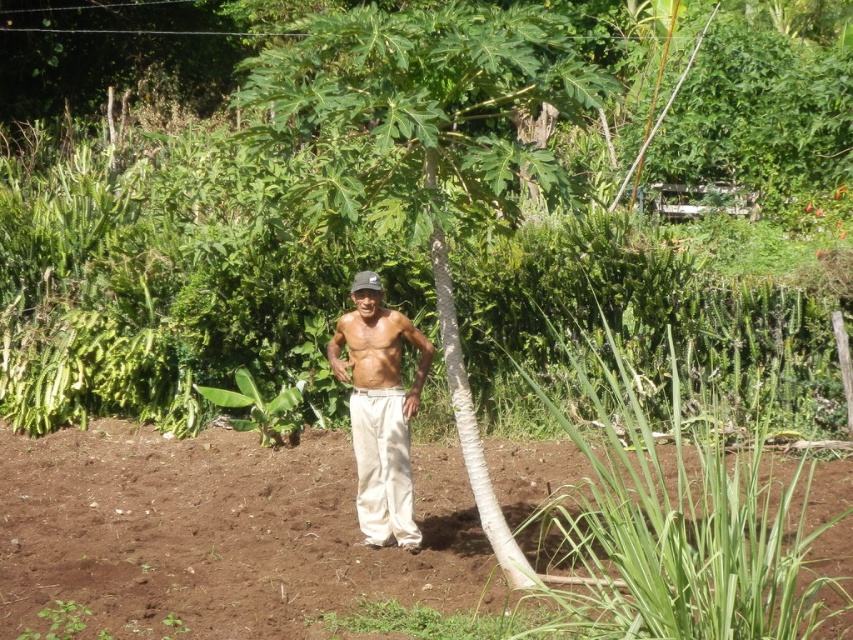
Measure the distance between point [399,538] and camera.

26.52 feet

Between white cotton pants at center and black fabric baseball hat at center, which one has more height?

Standing taller between the two is white cotton pants at center.

Where is `white cotton pants at center`? The image size is (853, 640). white cotton pants at center is located at coordinates (380, 413).

Does point (184, 588) come farther from viewer compared to point (477, 509)?

That is False.

Does brown soil at center have a greater width compared to green leafy banana tree at center?

In fact, brown soil at center might be narrower than green leafy banana tree at center.

What are the coordinates of `brown soil at center` in the screenshot? It's located at (219, 532).

Is brown soil at center below white cotton pants at center?

Yes.

Is brown soil at center taller than white cotton pants at center?

No.

The image size is (853, 640). In order to click on brown soil at center in this screenshot , I will do `click(219, 532)`.